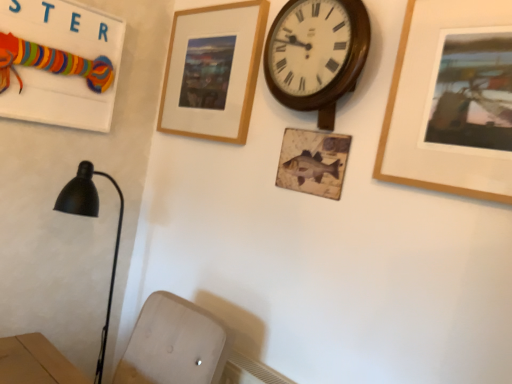
Question: Is wooden wall clock at upper center taller or shorter than wooden signboard at upper left?

Choices:
 (A) short
 (B) tall

Answer: (A)

Question: Is wooden wall clock at upper center to the left or to the right of wooden signboard at upper left in the image?

Choices:
 (A) left
 (B) right

Answer: (B)

Question: Estimate the real-world distances between objects in this image. Which object is farther from the wooden picture frame at upper center, which is the 2th picture frame in right-to-left order?

Choices:
 (A) wooden wall clock at upper center
 (B) wooden signboard at upper left
 (C) wooden picture frame at upper right, the 1th picture frame from the right

Answer: (C)

Question: Which of these objects is positioned farthest from the wooden signboard at upper left?

Choices:
 (A) wooden picture frame at upper center, the second picture frame positioned from the front
 (B) wooden wall clock at upper center
 (C) wooden picture frame at upper right, the 1th picture frame from the right

Answer: (C)